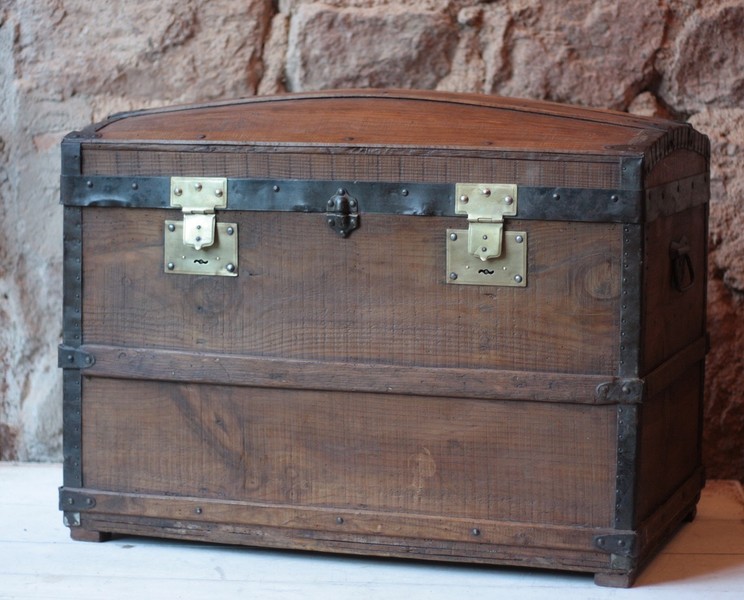
Identify the location of wooden floor. The height and width of the screenshot is (600, 744). (222, 573).